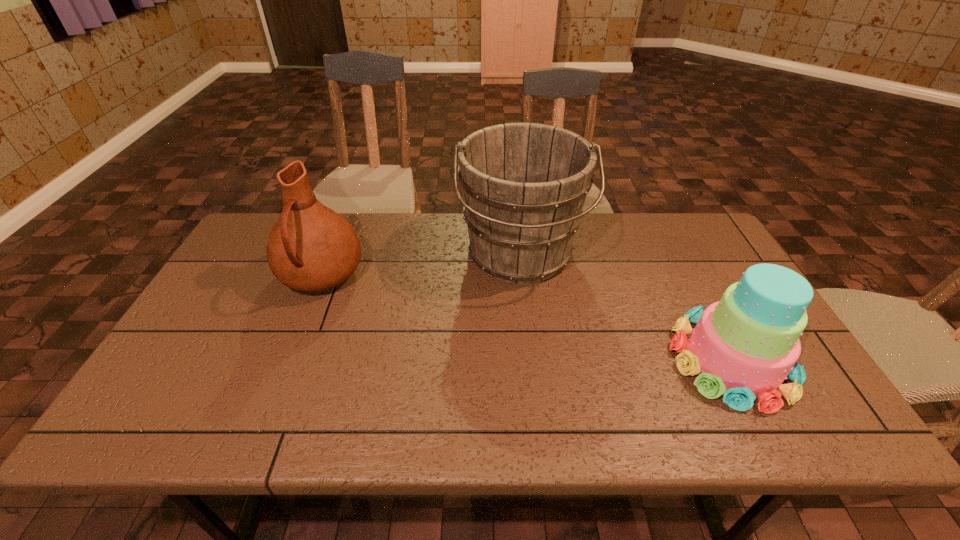
Locate an element on the screen. The image size is (960, 540). bucket is located at coordinates (524, 185).

This screenshot has width=960, height=540. What are the coordinates of `pitcher` in the screenshot? It's located at (311, 247).

You are a GUI agent. You are given a task and a screenshot of the screen. Output one action in this format:
    pyautogui.click(x=<x>, y=<y>)
    Task: Click on the rightmost object
    Image resolution: width=960 pixels, height=540 pixels.
    Given the screenshot: What is the action you would take?
    pyautogui.click(x=744, y=346)

I want to click on the nearest object, so click(744, 346).

Where is `vacant space situated on the handle side of the bucket`? The image size is (960, 540). vacant space situated on the handle side of the bucket is located at coordinates (535, 398).

Identify the location of free space located 0.280m on the side of the leftmost object with the handle. This screenshot has height=540, width=960. (273, 399).

Locate an element on the screen. The image size is (960, 540). free space located 0.310m on the back of the nearest object is located at coordinates (671, 243).

The height and width of the screenshot is (540, 960). I want to click on bucket that is at the far edge, so click(x=524, y=185).

Locate an element on the screen. pitcher that is at the far edge is located at coordinates (311, 247).

The image size is (960, 540). Find the location of `object that is at the near edge`. object that is at the near edge is located at coordinates (744, 346).